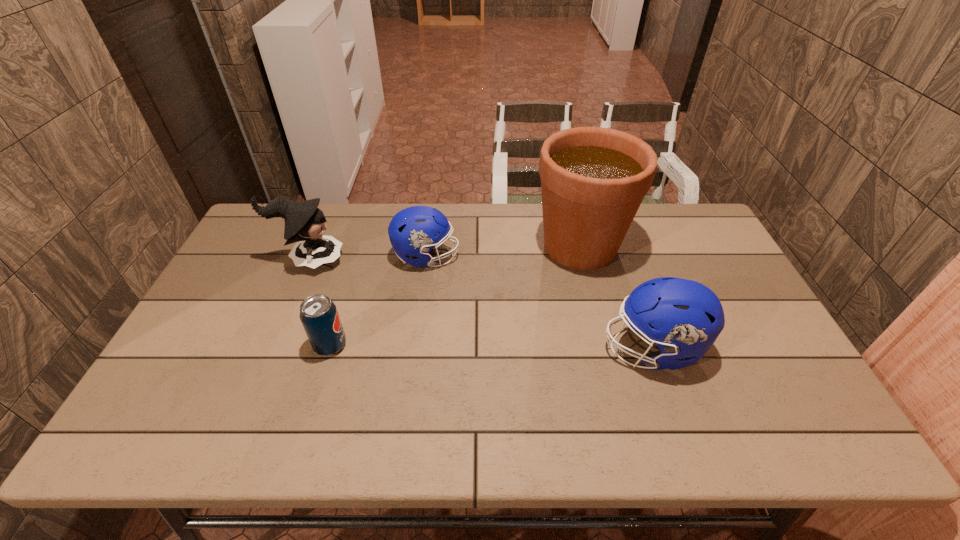
Locate an element on the screen. vacant region at the near edge of the desktop is located at coordinates (307, 429).

You are a GUI agent. You are given a task and a screenshot of the screen. Output one action in this format:
    pyautogui.click(x=<x>, y=<y>)
    Task: Click on the blank area at the right edge
    Image resolution: width=960 pixels, height=540 pixels.
    Given the screenshot: What is the action you would take?
    pyautogui.click(x=784, y=410)

What are the coordinates of `free space between the doll and the tallest object` in the screenshot? It's located at (444, 253).

Locate an element on the screen. This screenshot has height=540, width=960. free space that is in between the taller football helmet and the tallest object is located at coordinates (616, 298).

The width and height of the screenshot is (960, 540). I want to click on free point between the taller football helmet and the flowerpot, so click(616, 298).

I want to click on unoccupied position between the doll and the shorter football helmet, so coord(368,258).

You are a GUI agent. You are given a task and a screenshot of the screen. Output one action in this format:
    pyautogui.click(x=<x>, y=<y>)
    Task: Click on the vacant space that's between the shorter football helmet and the tallest object
    Image resolution: width=960 pixels, height=540 pixels.
    Given the screenshot: What is the action you would take?
    pyautogui.click(x=503, y=252)

Find the location of a particular element. empty space between the shorter football helmet and the tallest object is located at coordinates (503, 252).

Where is `free space between the flowerpot and the doll`? The width and height of the screenshot is (960, 540). free space between the flowerpot and the doll is located at coordinates (444, 253).

I want to click on vacant space in between the soda can and the nearer football helmet, so [492, 347].